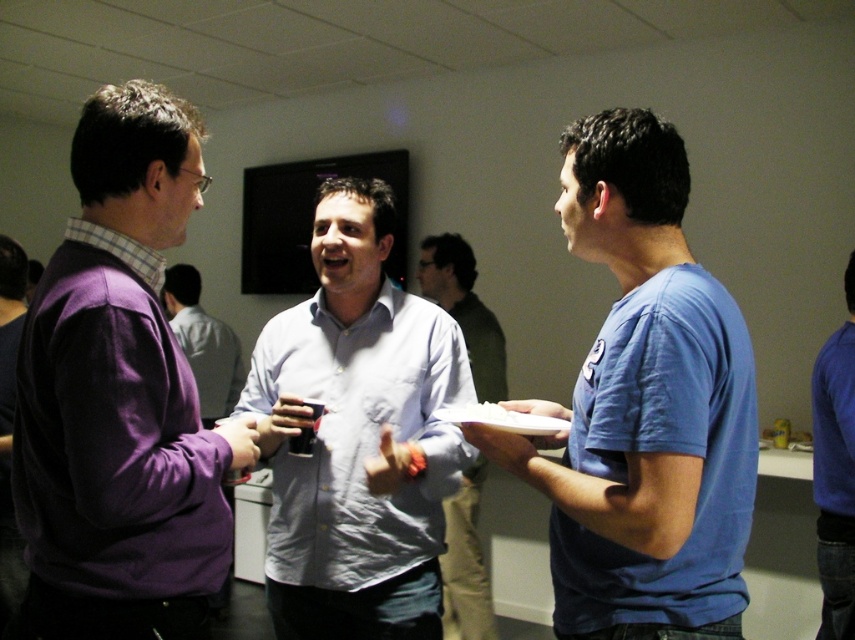
Question: Is light blue shirt at center below blue cotton shirt at right?

Choices:
 (A) yes
 (B) no

Answer: (B)

Question: Is light blue cotton shirt at center bigger than blue cotton shirt at right?

Choices:
 (A) no
 (B) yes

Answer: (B)

Question: Which point is closer to the camera?

Choices:
 (A) (150, 100)
 (B) (848, 621)

Answer: (A)

Question: Is purple matte sweater at left bigger than light blue shirt at center?

Choices:
 (A) no
 (B) yes

Answer: (B)

Question: Which object appears farthest from the camera in this image?

Choices:
 (A) light blue cotton shirt at center
 (B) purple matte sweater at left
 (C) blue cotton t-shirt at right

Answer: (A)

Question: Which object is farther from the camera taking this photo?

Choices:
 (A) blue cotton shirt at right
 (B) purple matte sweater at left

Answer: (A)